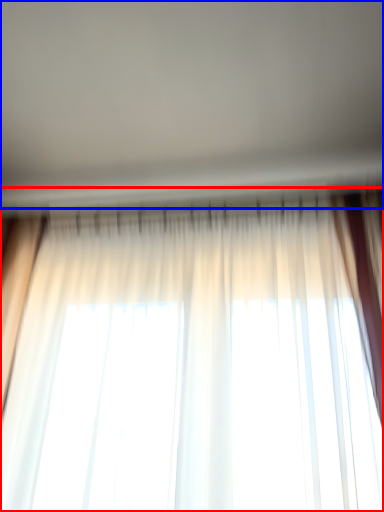
Question: Among these objects, which one is farthest to the camera, curtain (highlighted by a red box) or backdrop (highlighted by a blue box)?

Choices:
 (A) curtain
 (B) backdrop

Answer: (A)